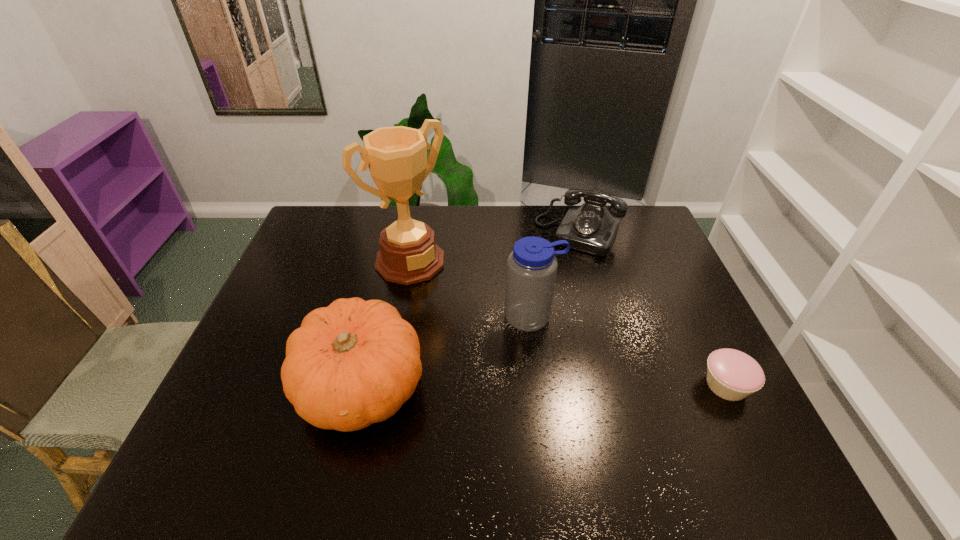
Point out which object is positioned as the fourth nearest to the water bottle. Please provide its 2D coordinates. Your answer should be formatted as a tuple, i.e. [(x, y)], where the tuple contains the x and y coordinates of a point satisfying the conditions above.

[(733, 375)]

In order to click on object that is the fourth nearest to the third shortest object in this screenshot , I will do `click(733, 375)`.

This screenshot has height=540, width=960. In order to click on blank space that satisfies the following two spatial constraints: 1. on the front side of the rightmost object; 2. on the right side of the third farthest object in this screenshot , I will do `click(540, 385)`.

What are the coordinates of `vacant space that satisfies the following two spatial constraints: 1. on the back side of the third tallest object; 2. on the right side of the second shortest object` in the screenshot? It's located at (397, 235).